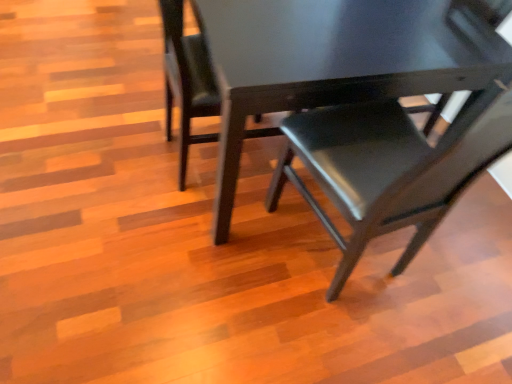
Question: Do you think matte black chair at center, arranged as the 1th chair when viewed from the right, is within matte black chair at center, which ranks as the 2th chair in left-to-right order, or outside of it?

Choices:
 (A) inside
 (B) outside

Answer: (B)

Question: Is point (272, 200) positioned closer to the camera than point (181, 153)?

Choices:
 (A) farther
 (B) closer

Answer: (B)

Question: Considering the real-world distances, which object is farthest from the matte black chair at center, which ranks as the 2th chair in left-to-right order?

Choices:
 (A) matte black chair at center, the 3th chair in the right-to-left sequence
 (B) matte black chair at center, the third chair viewed from the left

Answer: (B)

Question: Which of these objects is positioned closest to the matte black chair at center, the 1th chair when ordered from left to right?

Choices:
 (A) matte black chair at center, which ranks as the second chair in right-to-left order
 (B) matte black chair at center, the third chair viewed from the left

Answer: (A)